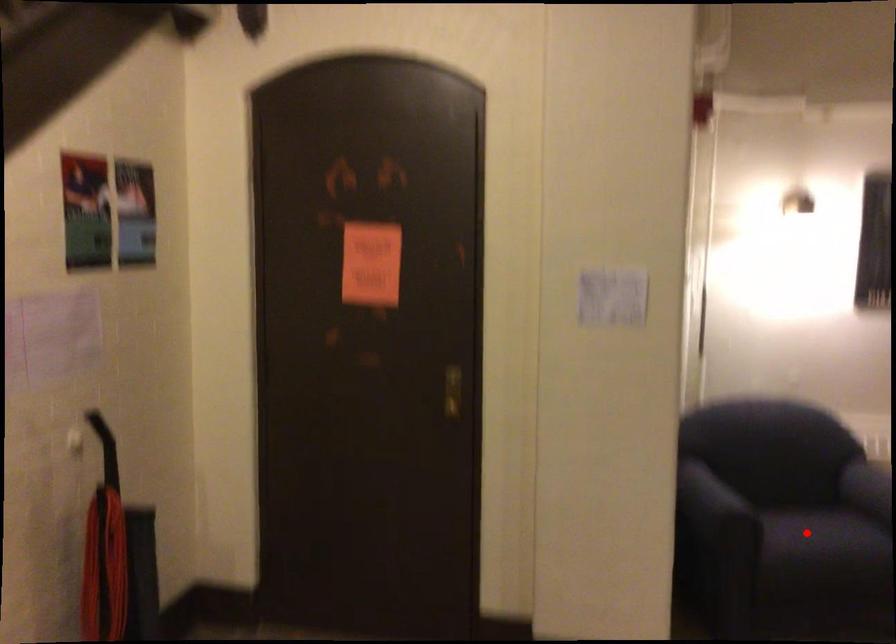
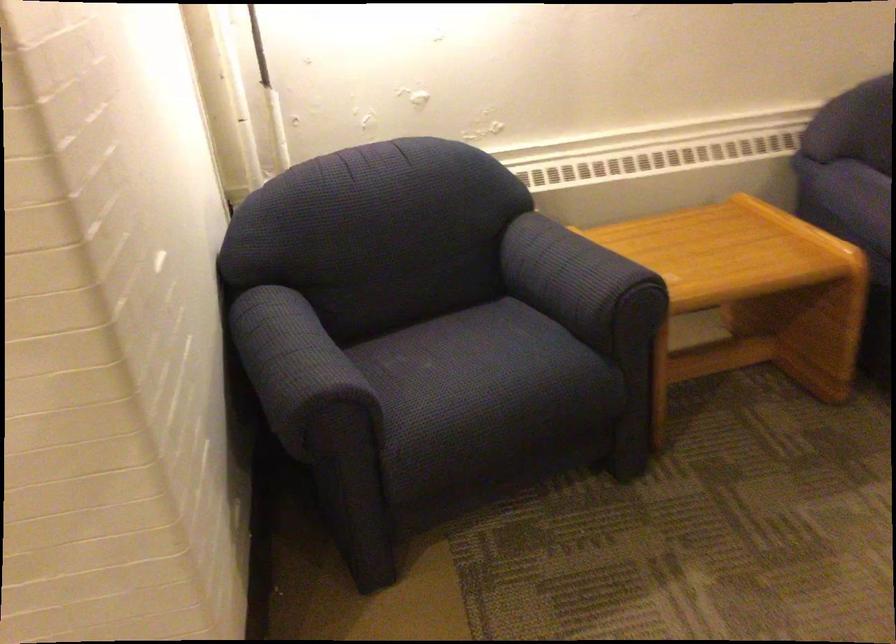
Locate, in the second image, the point that corresponds to the highlighted location in the first image.

(487, 377)